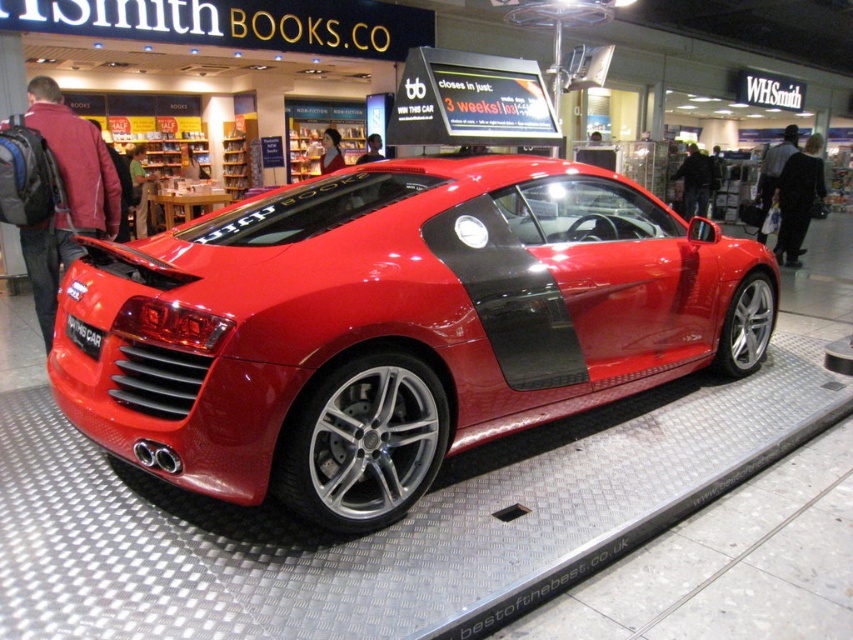
Is shiny red sports car at center behind black matte license plate at center?

No, it is in front of black matte license plate at center.

Does shiny red sports car at center appear under black matte license plate at center?

Actually, shiny red sports car at center is above black matte license plate at center.

Is point (527, 204) positioned in front of point (77, 344)?

No.

I want to click on shiny red sports car at center, so click(395, 326).